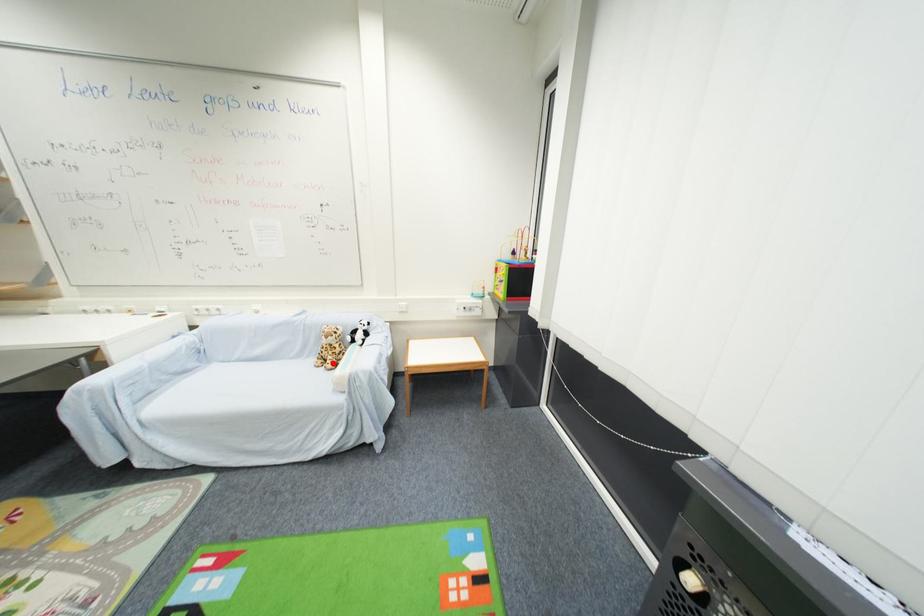
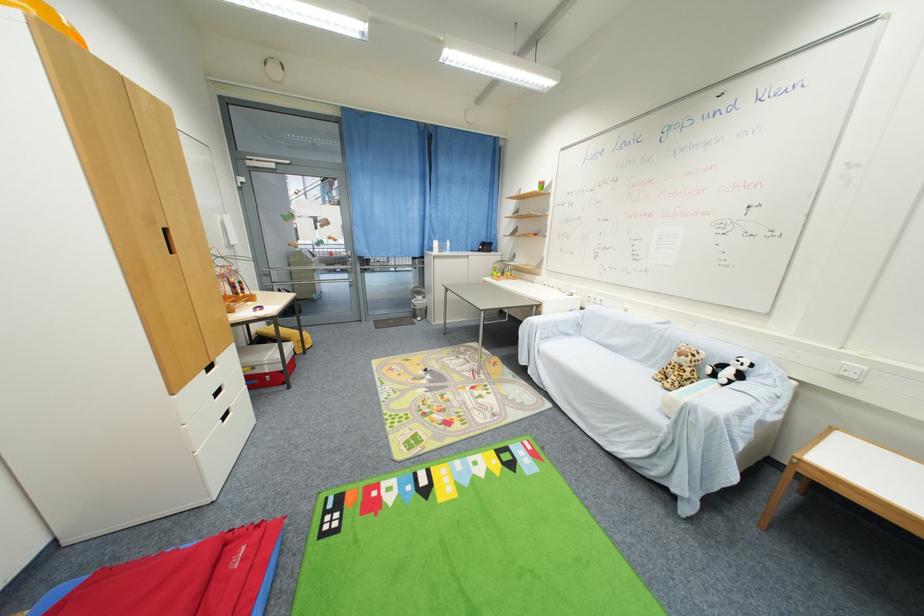
Find the pixel in the second image that matches the highlighted location in the first image.

(675, 382)